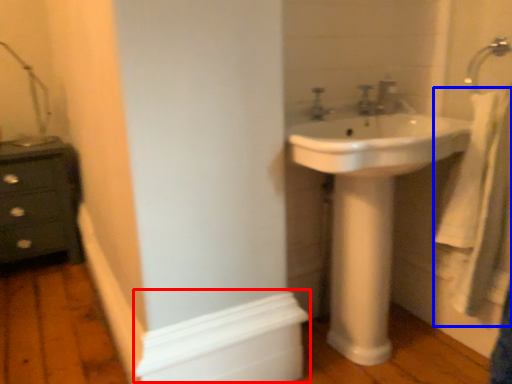
Question: Which of the following is the farthest to the observer, molding (highlighted by a red box) or bath towel (highlighted by a blue box)?

Choices:
 (A) molding
 (B) bath towel

Answer: (B)